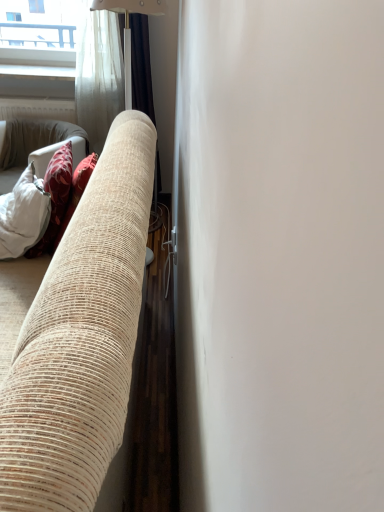
The image size is (384, 512). Describe the element at coordinates (129, 29) in the screenshot. I see `silky beige curtain at center` at that location.

What is the approximate width of silky beige curtain at center?

silky beige curtain at center is 13.47 inches in width.

This screenshot has width=384, height=512. What are the coordinates of `silky beige curtain at center` in the screenshot? It's located at (129, 29).

What is the approximate height of beige textured fabric couch at left?

beige textured fabric couch at left is 35.84 inches in height.

The height and width of the screenshot is (512, 384). What do you see at coordinates (81, 338) in the screenshot?
I see `beige textured fabric couch at left` at bounding box center [81, 338].

You are a GUI agent. You are given a task and a screenshot of the screen. Output one action in this format:
    pyautogui.click(x=<x>, y=<y>)
    Task: Click on the beige textured fabric couch at left
    Image resolution: width=384 pixels, height=512 pixels.
    Given the screenshot: What is the action you would take?
    pyautogui.click(x=81, y=338)

Find the location of `silky beige curtain at center`. silky beige curtain at center is located at coordinates (129, 29).

Which object is positioned more to the right, beige textured fabric couch at left or silky beige curtain at center?

silky beige curtain at center is more to the right.

Considering their positions, is beige textured fabric couch at left located in front of or behind silky beige curtain at center?

beige textured fabric couch at left is in front of silky beige curtain at center.

Between point (136, 164) and point (130, 61), which one is positioned in front?

The point (136, 164) is closer to the camera.

From the image's perspective, which is below, beige textured fabric couch at left or silky beige curtain at center?

beige textured fabric couch at left is shown below in the image.

From a real-world perspective, is beige textured fabric couch at left on silky beige curtain at center?

No, from a real-world perspective, beige textured fabric couch at left is not on top of silky beige curtain at center.

Between beige textured fabric couch at left and silky beige curtain at center, which one has larger width?

beige textured fabric couch at left is wider.

Based on the photo, between beige textured fabric couch at left and silky beige curtain at center, which one has less height?

beige textured fabric couch at left.

In the scene shown: Who is smaller, beige textured fabric couch at left or silky beige curtain at center?

silky beige curtain at center.

Is beige textured fabric couch at left located outside silky beige curtain at center?

Indeed, beige textured fabric couch at left is completely outside silky beige curtain at center.

Are beige textured fabric couch at left and silky beige curtain at center located far from each other?

Yes.

Is beige textured fabric couch at left oriented towards silky beige curtain at center?

No.

Based on the photo, can you tell me how much beige textured fabric couch at left and silky beige curtain at center differ in facing direction?

There is a 3.05-degree angle between the facing directions of beige textured fabric couch at left and silky beige curtain at center.

Locate an element on the screen. Image resolution: width=384 pixels, height=512 pixels. studio couch located in front of the silky beige curtain at center is located at coordinates (81, 338).

Which object is positioned more to the right, silky beige curtain at center or beige textured fabric couch at left?

silky beige curtain at center.

Considering their positions, is silky beige curtain at center located in front of or behind beige textured fabric couch at left?

In the image, silky beige curtain at center appears behind beige textured fabric couch at left.

Which is behind, point (146, 10) or point (122, 137)?

The point (146, 10) is farther from the camera.

From the image's perspective, is silky beige curtain at center under beige textured fabric couch at left?

Incorrect, from the image's perspective, silky beige curtain at center is higher than beige textured fabric couch at left.

From a real-world perspective, which is physically above, silky beige curtain at center or beige textured fabric couch at left?

silky beige curtain at center.

Can you confirm if silky beige curtain at center is thinner than beige textured fabric couch at left?

Yes.

Is silky beige curtain at center taller than beige textured fabric couch at left?

Correct, silky beige curtain at center is much taller as beige textured fabric couch at left.

Which of these two, silky beige curtain at center or beige textured fabric couch at left, is smaller?

Smaller between the two is silky beige curtain at center.

Would you say silky beige curtain at center is inside or outside beige textured fabric couch at left?

silky beige curtain at center is located beyond the bounds of beige textured fabric couch at left.

Is silky beige curtain at center touching beige textured fabric couch at left?

They are not placed beside each other.

Is silky beige curtain at center aimed at beige textured fabric couch at left?

No.

How many degrees apart are the facing directions of silky beige curtain at center and beige textured fabric couch at left?

There is a 3.05-degree angle between the facing directions of silky beige curtain at center and beige textured fabric couch at left.

Image resolution: width=384 pixels, height=512 pixels. I want to click on studio couch lying below the silky beige curtain at center (from the image's perspective), so click(x=81, y=338).

What are the coordinates of `studio couch on the left of silky beige curtain at center` in the screenshot? It's located at (81, 338).

This screenshot has width=384, height=512. I want to click on curtain above the beige textured fabric couch at left (from a real-world perspective), so click(129, 29).